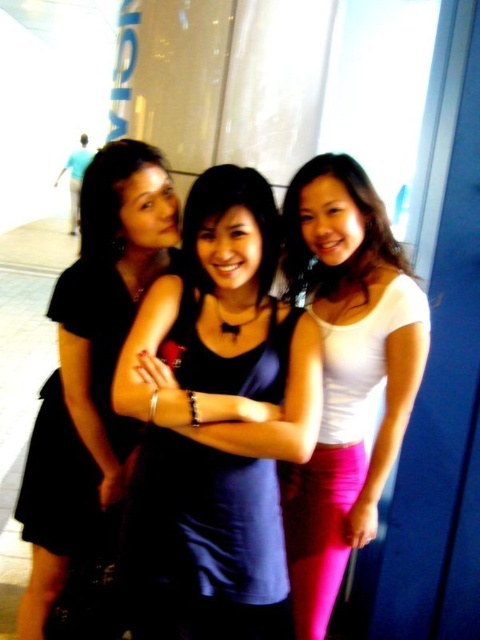
The width and height of the screenshot is (480, 640). What do you see at coordinates (217, 422) in the screenshot? I see `matte blue tank top at center` at bounding box center [217, 422].

Does matte blue tank top at center come behind black matte dress at left?

No, matte blue tank top at center is closer to the viewer.

What are the coordinates of `matte blue tank top at center` in the screenshot? It's located at (217, 422).

The height and width of the screenshot is (640, 480). I want to click on matte blue tank top at center, so click(x=217, y=422).

From the picture: Does white matte shirt at center have a lesser width compared to black matte dress at left?

Yes.

Who is higher up, white matte shirt at center or black matte dress at left?

white matte shirt at center is higher up.

Is point (377, 208) positioned in front of point (86, 365)?

Yes, it is.

Locate an element on the screen. The width and height of the screenshot is (480, 640). white matte shirt at center is located at coordinates (346, 371).

Is white matte shirt at center bigger than black matte dress at center?

Yes, white matte shirt at center is bigger than black matte dress at center.

Which of these two, white matte shirt at center or black matte dress at center, stands taller?

With more height is white matte shirt at center.

Is point (328, 317) farther from viewer compared to point (96, 474)?

No.

Where is `white matte shirt at center`? white matte shirt at center is located at coordinates (346, 371).